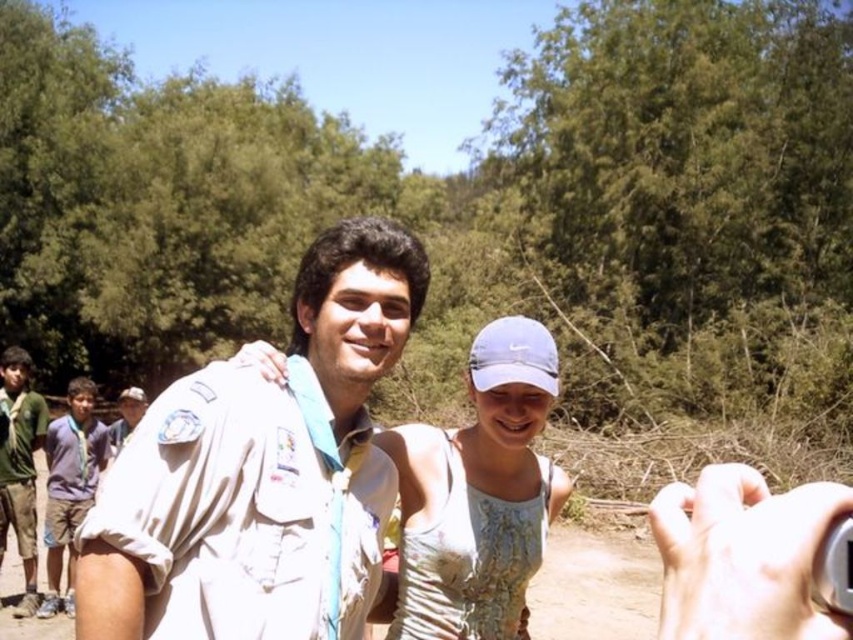
You are standing at the camera position and want to place a 2.0 meter long banner between you and the point at point (479, 579). Will the banner be long enough to reach that point?

The distance between you and the point at point (479, 579) is 1.93 meters. Since the banner is 2.0 meters long, it will be long enough to reach the point.